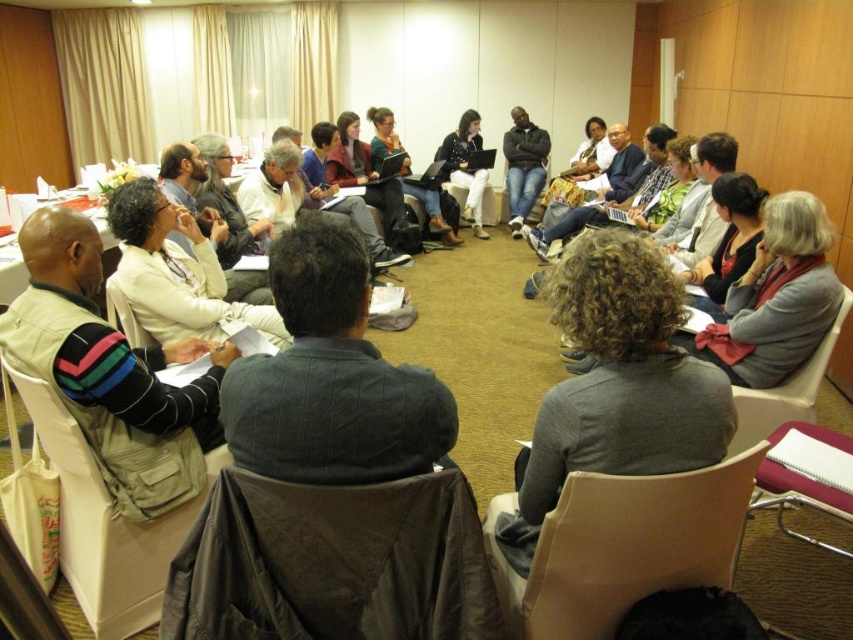
Does dark gray sweater at center have a smaller size compared to striped sweater at center?

Yes.

Does point (363, 285) come closer to viewer compared to point (45, 314)?

Yes.

Where is `dark gray sweater at center`? This screenshot has height=640, width=853. dark gray sweater at center is located at coordinates (329, 378).

You are a GUI agent. You are given a task and a screenshot of the screen. Output one action in this format:
    pyautogui.click(x=<x>, y=<y>)
    Task: Click on the khaki fabric chair at lower left
    The image size is (853, 640).
    Given the screenshot: What is the action you would take?
    pyautogui.click(x=105, y=524)

Between point (184, 524) and point (474, 228), which one is positioned behind?

The point (474, 228) is behind.

Who is more forward, (136, 536) or (457, 173)?

Positioned in front is point (136, 536).

Where is `khaki fabric chair at lower left`? This screenshot has height=640, width=853. khaki fabric chair at lower left is located at coordinates (105, 524).

Between gray sweater at center and khaki fabric chair at lower left, which one has less height?

gray sweater at center

Can you confirm if gray sweater at center is bigger than khaki fabric chair at lower left?

Correct, gray sweater at center is larger in size than khaki fabric chair at lower left.

Between point (665, 461) and point (155, 612), which one is positioned behind?

Point (155, 612)

Image resolution: width=853 pixels, height=640 pixels. In order to click on gray sweater at center in this screenshot , I will do `click(616, 385)`.